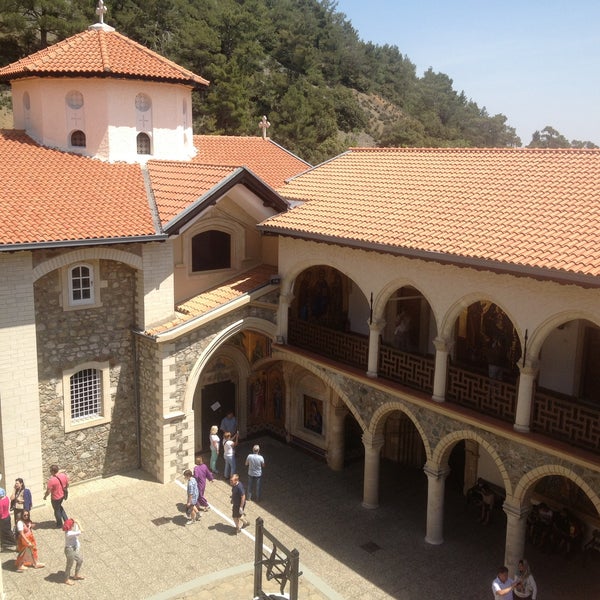
I want to click on columns, so click(375, 344), click(438, 365), click(522, 403), click(522, 533), click(437, 507), click(372, 470).